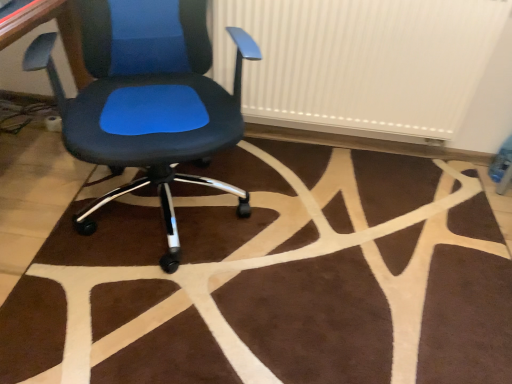
Question: Should I look upward or downward to see matte black office chair at center?

Choices:
 (A) up
 (B) down

Answer: (A)

Question: Is there a large distance between brown plush rug at center and white ribbed radiator at upper center?

Choices:
 (A) no
 (B) yes

Answer: (A)

Question: Can you confirm if brown plush rug at center is shorter than white ribbed radiator at upper center?

Choices:
 (A) no
 (B) yes

Answer: (B)

Question: Is brown plush rug at center next to white ribbed radiator at upper center?

Choices:
 (A) no
 (B) yes

Answer: (A)

Question: From the image's perspective, is brown plush rug at center beneath white ribbed radiator at upper center?

Choices:
 (A) yes
 (B) no

Answer: (A)

Question: Does brown plush rug at center have a larger size compared to white ribbed radiator at upper center?

Choices:
 (A) no
 (B) yes

Answer: (A)

Question: Considering the relative sizes of brown plush rug at center and white ribbed radiator at upper center in the image provided, is brown plush rug at center taller than white ribbed radiator at upper center?

Choices:
 (A) yes
 (B) no

Answer: (B)

Question: Is brown plush rug at center in front of matte black office chair at center?

Choices:
 (A) yes
 (B) no

Answer: (B)

Question: Considering the relative sizes of brown plush rug at center and matte black office chair at center in the image provided, is brown plush rug at center bigger than matte black office chair at center?

Choices:
 (A) no
 (B) yes

Answer: (A)

Question: Does brown plush rug at center lie behind matte black office chair at center?

Choices:
 (A) yes
 (B) no

Answer: (A)

Question: Is brown plush rug at center not close to matte black office chair at center?

Choices:
 (A) yes
 (B) no

Answer: (B)

Question: Is brown plush rug at center looking in the opposite direction of matte black office chair at center?

Choices:
 (A) yes
 (B) no

Answer: (B)

Question: From the image's perspective, is brown plush rug at center over matte black office chair at center?

Choices:
 (A) no
 (B) yes

Answer: (A)

Question: From a real-world perspective, is white ribbed radiator at upper center on top of matte black office chair at center?

Choices:
 (A) yes
 (B) no

Answer: (A)